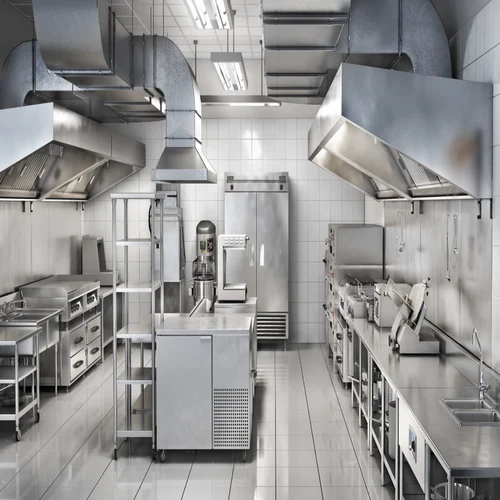
The width and height of the screenshot is (500, 500). What are the coordinates of `hood` in the screenshot? It's located at (371, 159).